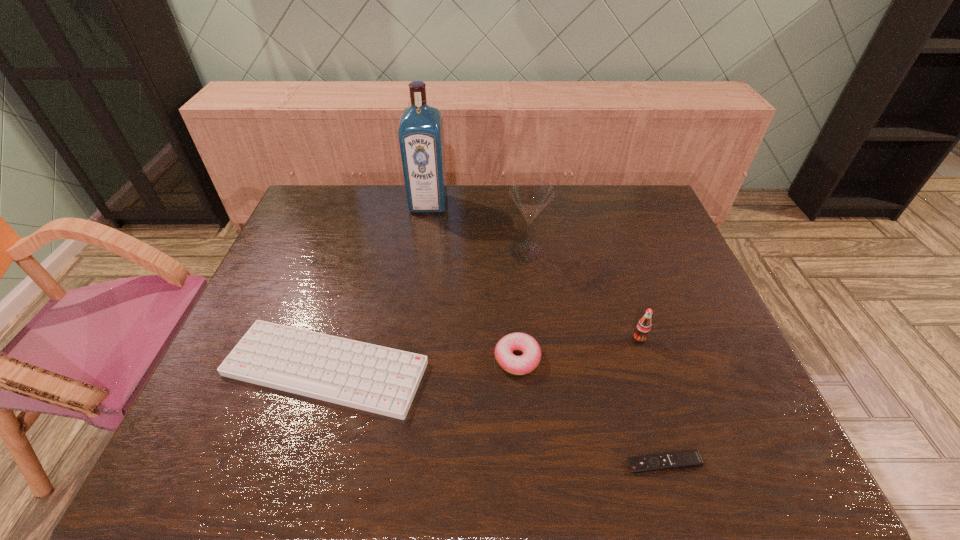
At what (x,y) coordinates should I click in order to perform the action: click on the farthest object. Please return your answer as a coordinate pair (x, y). This screenshot has height=540, width=960. Looking at the image, I should click on (421, 138).

The image size is (960, 540). Find the location of `the tallest object`. the tallest object is located at coordinates (421, 138).

Locate an element on the screen. The width and height of the screenshot is (960, 540). the fifth nearest object is located at coordinates (531, 196).

In order to click on the second tallest object in this screenshot , I will do (x=531, y=196).

Identify the location of soda. The width and height of the screenshot is (960, 540). (643, 327).

This screenshot has width=960, height=540. I want to click on the fourth tallest object, so coord(518,365).

Find the location of a particular element. Image resolution: width=960 pixels, height=540 pixels. computer keyboard is located at coordinates (382, 380).

Locate an element on the screen. The image size is (960, 540). the shortest object is located at coordinates (687, 459).

Locate an element on the screen. The height and width of the screenshot is (540, 960). the nearest object is located at coordinates (687, 459).

You are a GUI agent. You are given a task and a screenshot of the screen. Output one action in this format:
    pyautogui.click(x=<x>, y=<y>)
    Task: Click on the vacant space situated 0.320m on the flat label side of the liquor
    This screenshot has height=540, width=960.
    Given the screenshot: What is the action you would take?
    pyautogui.click(x=417, y=282)